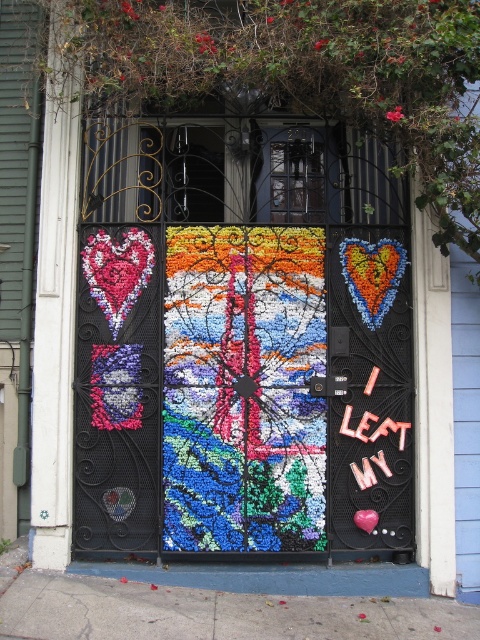
Question: Does pink plastic letters at center right appear under pink matte heart at center?

Choices:
 (A) no
 (B) yes

Answer: (A)

Question: Which of these objects is positioned closest to the pink plastic letters at center right?

Choices:
 (A) multicolored mosaic door at center
 (B) pink matte heart at center

Answer: (B)

Question: Among these objects, which one is nearest to the camera?

Choices:
 (A) multicolored mosaic door at center
 (B) pink matte heart at center

Answer: (A)

Question: Is multicolored mosaic door at center to the right of pink matte heart at center from the viewer's perspective?

Choices:
 (A) yes
 (B) no

Answer: (B)

Question: Can you confirm if multicolored mosaic door at center is bigger than pink matte heart at center?

Choices:
 (A) no
 (B) yes

Answer: (B)

Question: Which is nearer to the multicolored mosaic door at center?

Choices:
 (A) pink matte heart at center
 (B) pink plastic letters at center right

Answer: (B)